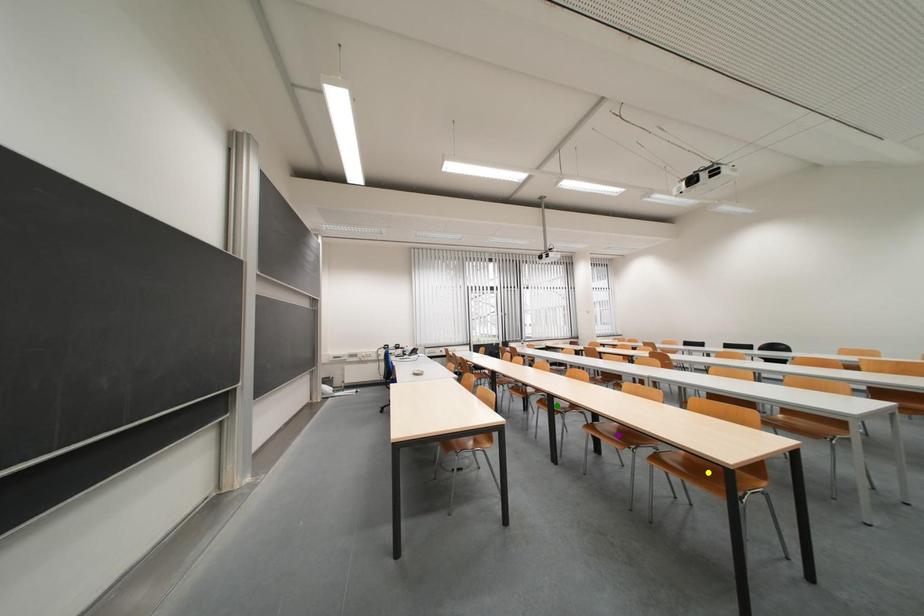
Order these from nearest to farthest:
1. green point
2. purple point
3. yellow point

yellow point < purple point < green point